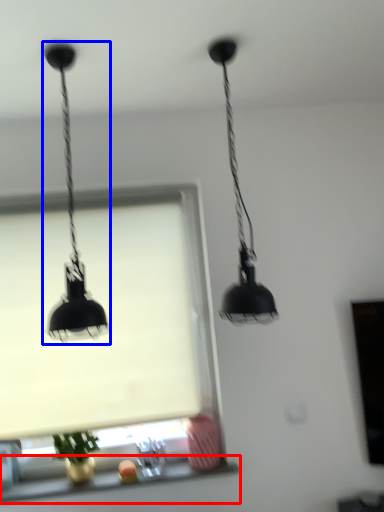
Question: Which object is closer to the camera taking this photo, window sill (highlighted by a red box) or lamp (highlighted by a blue box)?

Choices:
 (A) window sill
 (B) lamp

Answer: (B)